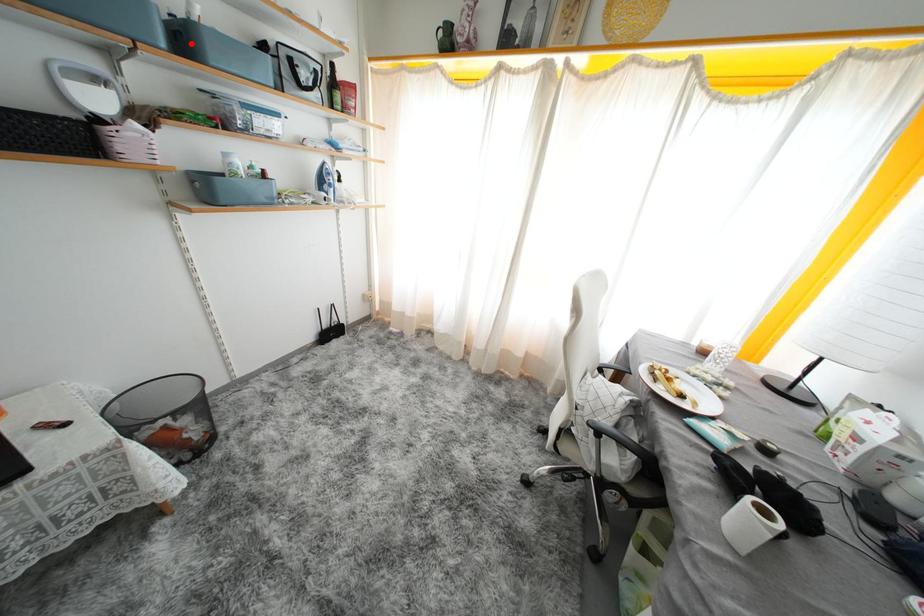
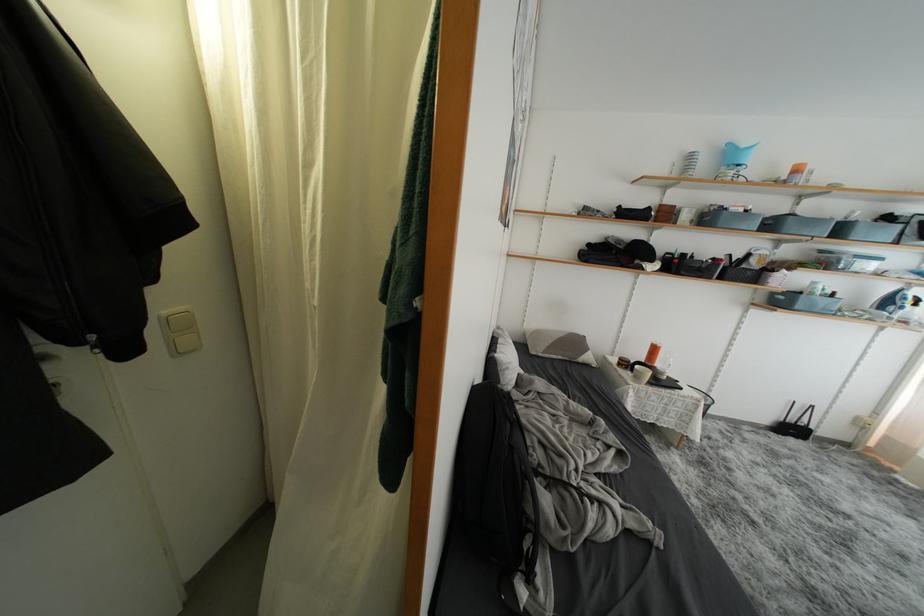
Locate, in the second image, the point that corresponds to the highlighted location in the first image.

(847, 235)